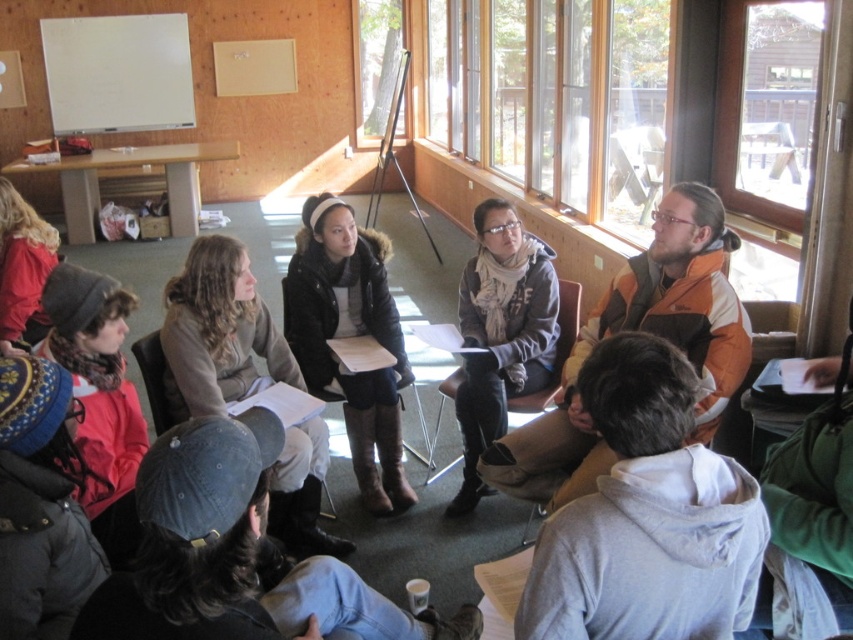
Question: Which point is farther to the camera?

Choices:
 (A) [186, 272]
 (B) [686, 344]
 (C) [460, 301]

Answer: (C)

Question: Is orange and brown jacket at upper right closer to the viewer compared to brown fuzzy coat at center?

Choices:
 (A) no
 (B) yes

Answer: (B)

Question: Which object appears farthest from the camera in this image?

Choices:
 (A) gray wool scarf at center
 (B) brown fuzzy coat at center

Answer: (B)

Question: Which point appears closest to the camera in this image?

Choices:
 (A) (283, 524)
 (B) (517, 364)
 (C) (698, 282)
 (D) (329, 380)

Answer: (C)

Question: Does brown fuzzy coat at center come in front of gray wool scarf at center?

Choices:
 (A) no
 (B) yes

Answer: (A)

Question: Considering the relative positions of orange and brown jacket at upper right and brown leather jacket at center in the image provided, where is orange and brown jacket at upper right located with respect to brown leather jacket at center?

Choices:
 (A) above
 (B) below

Answer: (A)